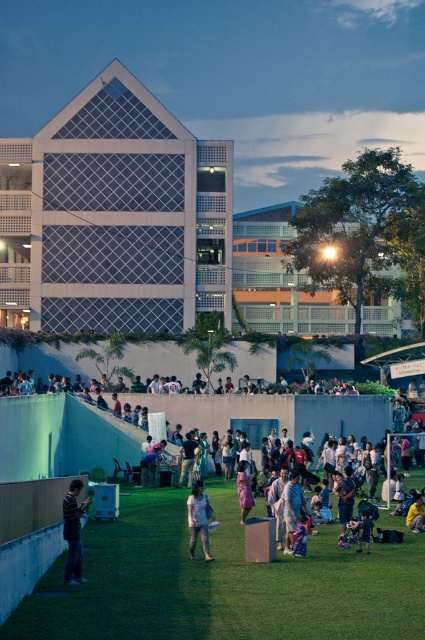
In the scene shown: You are standing at the edge of the grassy field next to the modern building. You see a light blue fabric at center and denim shorts at center. If you want to pick up both items, which one should you walk towards first to minimize the total distance walked?

Since the light blue fabric at center and denim shorts at center are 9.23 meters apart, you should pick up whichever is closer to your starting position first to minimize the total distance walked.

You are organizing a photoshoot and need to ensure that the striped cotton shirt at lower left and the pink fabric dress at center are visible in the frame. Given their sizes, which one might require more careful positioning to avoid being overshadowed?

The striped cotton shirt at lower left occupies less space than the pink fabric dress at center, so it might require more careful positioning to avoid being overshadowed.